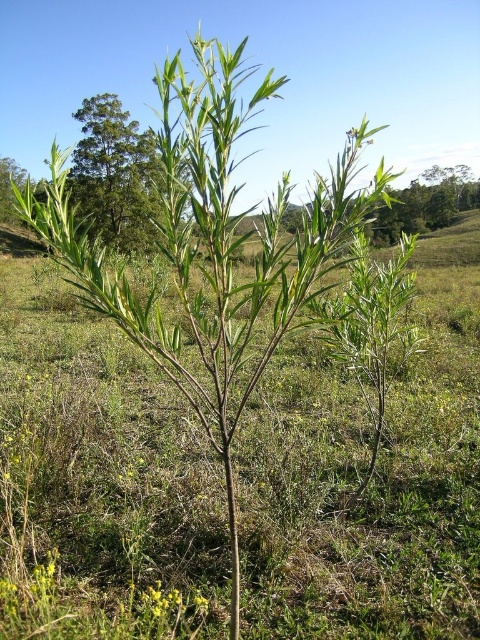
Find the location of `green leafy tree at upper left`. green leafy tree at upper left is located at coordinates (113, 173).

Consider the image. Is green leafy tree at upper left above yellow matte flower at lower center?

Indeed, green leafy tree at upper left is positioned over yellow matte flower at lower center.

The width and height of the screenshot is (480, 640). Describe the element at coordinates (113, 173) in the screenshot. I see `green leafy tree at upper left` at that location.

You are a GUI agent. You are given a task and a screenshot of the screen. Output one action in this format:
    pyautogui.click(x=<x>, y=<y>)
    Task: Click on the green leafy tree at upper left
    This screenshot has width=480, height=640.
    Given the screenshot: What is the action you would take?
    pyautogui.click(x=113, y=173)